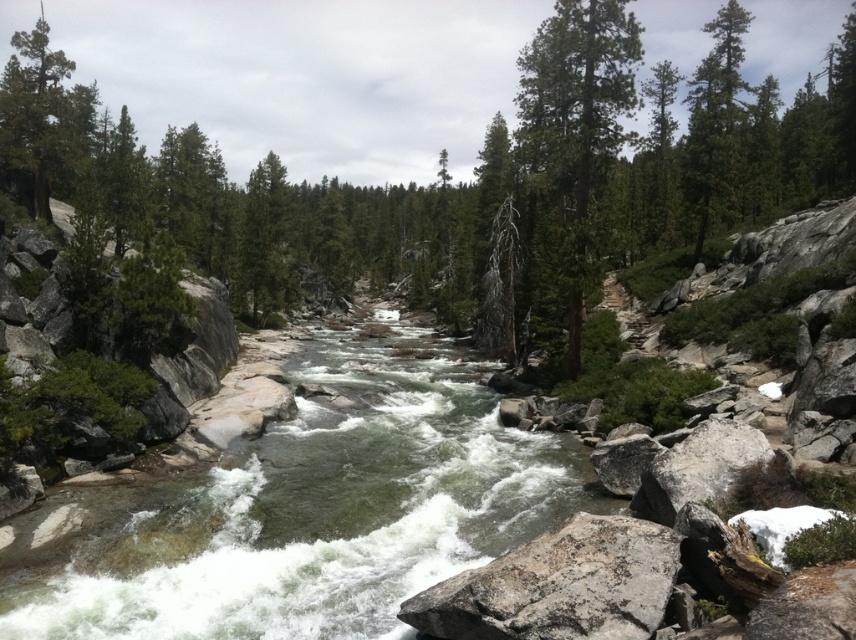
Can you confirm if gray rough rock at center is positioned below green matte tree at center?

Indeed, gray rough rock at center is positioned under green matte tree at center.

Which is more to the right, gray rough rock at center or green matte tree at center?

From the viewer's perspective, green matte tree at center appears more on the right side.

Is point (643, 538) farther from camera compared to point (616, 38)?

No, it is not.

Where is `gray rough rock at center`? This screenshot has width=856, height=640. gray rough rock at center is located at coordinates (559, 586).

Image resolution: width=856 pixels, height=640 pixels. Describe the element at coordinates (462, 182) in the screenshot. I see `green textured tree at center` at that location.

Can you confirm if green textured tree at center is smaller than gray rough rock at center?

Actually, green textured tree at center might be larger than gray rough rock at center.

What do you see at coordinates (462, 182) in the screenshot? Image resolution: width=856 pixels, height=640 pixels. I see `green textured tree at center` at bounding box center [462, 182].

Where is `green textured tree at center`? The width and height of the screenshot is (856, 640). green textured tree at center is located at coordinates (462, 182).

Can you confirm if green matte tree at center is shorter than green matte tree at upper left?

Yes, green matte tree at center is shorter than green matte tree at upper left.

Is green matte tree at center above green matte tree at upper left?

No, green matte tree at center is not above green matte tree at upper left.

Does point (563, 216) come farther from viewer compared to point (34, 205)?

No, (563, 216) is in front of (34, 205).

Image resolution: width=856 pixels, height=640 pixels. I want to click on green matte tree at center, so click(x=575, y=125).